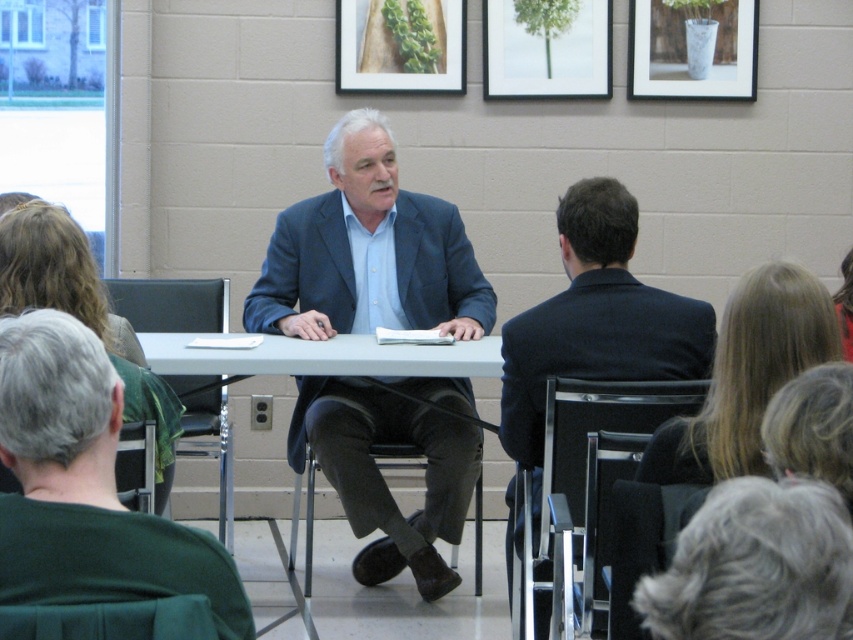
Is point (520, 595) farther from camera compared to point (376, 60)?

No, (520, 595) is in front of (376, 60).

Looking at this image, can you confirm if metallic silver chair at lower right is shorter than wooden frame at upper center?

In fact, metallic silver chair at lower right may be taller than wooden frame at upper center.

Image resolution: width=853 pixels, height=640 pixels. Find the location of `metallic silver chair at lower right`. metallic silver chair at lower right is located at coordinates (598, 422).

Is point (556, 56) positioned after point (165, 314)?

Yes, it is behind point (165, 314).

Between white matte picture frame at upper center and black leather chair at left, which one appears on the right side from the viewer's perspective?

white matte picture frame at upper center

Image resolution: width=853 pixels, height=640 pixels. I want to click on white matte picture frame at upper center, so click(x=546, y=52).

I want to click on white matte picture frame at upper center, so click(546, 52).

Which of these two, metallic silver chair at lower right or black leather chair at left, stands taller?

black leather chair at left is taller.

Does metallic silver chair at lower right appear over black leather chair at left?

Incorrect, metallic silver chair at lower right is not positioned above black leather chair at left.

Which is in front, point (664, 392) or point (183, 381)?

Point (664, 392) is more forward.

Where is `metallic silver chair at lower right`? metallic silver chair at lower right is located at coordinates (598, 422).